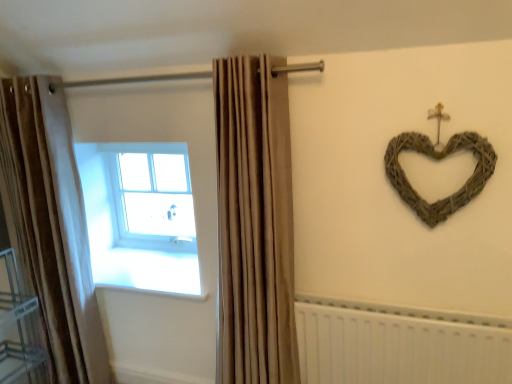
Describe the element at coordinates (398, 344) in the screenshot. Image resolution: width=512 pixels, height=384 pixels. I see `white plastic radiator at lower right` at that location.

What is the approximate height of beige fabric curtain at center, which appears as the 2th curtain when viewed from the left?

beige fabric curtain at center, which appears as the 2th curtain when viewed from the left, is 4.85 feet tall.

Image resolution: width=512 pixels, height=384 pixels. What do you see at coordinates (150, 195) in the screenshot?
I see `white glass window at upper left` at bounding box center [150, 195].

Find the location of a particular element. This screenshot has height=384, width=512. white plastic radiator at lower right is located at coordinates (398, 344).

In the image, is white glass window at upper left on the left side or the right side of metallic silver shelf at lower left?

In the image, white glass window at upper left appears on the right side of metallic silver shelf at lower left.

Is white glass window at upper left looking in the opposite direction of metallic silver shelf at lower left?

No, metallic silver shelf at lower left is not at the back of white glass window at upper left.

Does point (178, 175) appear closer or farther from the camera than point (27, 378)?

Point (178, 175) appears to be farther away from the viewer than point (27, 378).

Consider the image. Is woven natural heart at upper right facing away from white plastic radiator at lower right?

No.

Which point is more forward, (406, 144) or (332, 319)?

Positioned in front is point (406, 144).

From a real-world perspective, is woven natural heart at upper right over white plastic radiator at lower right?

Yes, from a real-world perspective, woven natural heart at upper right is above white plastic radiator at lower right.

Is the surface of beige fabric curtain at center, which appears as the 2th curtain when viewed from the left, in direct contact with beige velvet curtain at left, which is counted as the 1th curtain, starting from the left?

They are not placed beside each other.

From a real-world perspective, is beige fabric curtain at center, which ranks as the first curtain in right-to-left order, positioned above or below beige velvet curtain at left, which is counted as the 1th curtain, starting from the left?

Clearly, from a real-world perspective, beige fabric curtain at center, which ranks as the first curtain in right-to-left order, is above beige velvet curtain at left, which is counted as the 1th curtain, starting from the left.

Is beige velvet curtain at left, which is counted as the 1th curtain, starting from the left, completely or partially inside beige fabric curtain at center, which ranks as the first curtain in right-to-left order?

Definitely not — beige velvet curtain at left, which is counted as the 1th curtain, starting from the left, is not inside beige fabric curtain at center, which ranks as the first curtain in right-to-left order.

Would you say beige fabric curtain at center, which ranks as the first curtain in right-to-left order, is to the left or to the right of beige velvet curtain at left, which is counted as the 1th curtain, starting from the left, in the picture?

beige fabric curtain at center, which ranks as the first curtain in right-to-left order, is to the right of beige velvet curtain at left, which is counted as the 1th curtain, starting from the left.

Which point is more forward, (38, 146) or (321, 326)?

The point (321, 326) is closer.

How different are the orientations of beige velvet curtain at left, which is counted as the 1th curtain, starting from the left, and white plastic radiator at lower right in degrees?

The angle between the facing direction of beige velvet curtain at left, which is counted as the 1th curtain, starting from the left, and the facing direction of white plastic radiator at lower right is 3.16 degrees.

From a real-world perspective, relative to white plastic radiator at lower right, is beige velvet curtain at left, which is counted as the 1th curtain, starting from the left, vertically above or below?

From a real-world perspective, beige velvet curtain at left, which is counted as the 1th curtain, starting from the left, is physically above white plastic radiator at lower right.

Is beige velvet curtain at left, which is counted as the 1th curtain, starting from the left, positioned behind white plastic radiator at lower right?

Yes, beige velvet curtain at left, which is counted as the 1th curtain, starting from the left, is behind white plastic radiator at lower right.

Could you measure the distance between beige fabric curtain at center, which ranks as the first curtain in right-to-left order, and white plastic radiator at lower right?

beige fabric curtain at center, which ranks as the first curtain in right-to-left order, is 15.07 inches away from white plastic radiator at lower right.

Is beige fabric curtain at center, which ranks as the first curtain in right-to-left order, situated inside white plastic radiator at lower right or outside?

beige fabric curtain at center, which ranks as the first curtain in right-to-left order, is located beyond the bounds of white plastic radiator at lower right.

Who is bigger, beige fabric curtain at center, which appears as the 2th curtain when viewed from the left, or white plastic radiator at lower right?

Bigger between the two is beige fabric curtain at center, which appears as the 2th curtain when viewed from the left.

Is beige fabric curtain at center, which appears as the 2th curtain when viewed from the left, taller than white plastic radiator at lower right?

Yes.

How many degrees apart are the facing directions of white plastic radiator at lower right and white glass window at upper left?

1.9 degrees separate the facing orientations of white plastic radiator at lower right and white glass window at upper left.

Does point (367, 350) lie behind point (136, 233)?

No, (367, 350) is in front of (136, 233).

From a real-world perspective, is white plastic radiator at lower right under white glass window at upper left?

Correct, in the physical world, white plastic radiator at lower right is lower than white glass window at upper left.

Locate an element on the screen. The width and height of the screenshot is (512, 384). radiator in front of the white glass window at upper left is located at coordinates (398, 344).

Measure the distance from beige velvet curtain at left, the 2th curtain in the right-to-left sequence, to metallic silver shelf at lower left.

beige velvet curtain at left, the 2th curtain in the right-to-left sequence, and metallic silver shelf at lower left are 24.75 centimeters apart from each other.

Can metallic silver shelf at lower left be found inside beige velvet curtain at left, the 2th curtain in the right-to-left sequence?

Actually, metallic silver shelf at lower left is outside beige velvet curtain at left, the 2th curtain in the right-to-left sequence.

Considering the points (47, 291) and (12, 278), which point is behind, point (47, 291) or point (12, 278)?

The point (12, 278) is farther from the camera.

Is beige velvet curtain at left, the 2th curtain in the right-to-left sequence, touching metallic silver shelf at lower left?

They are not placed beside each other.

At what (x,y) coordinates should I click in order to perform the action: click on window on the right of metallic silver shelf at lower left. Please return your answer as a coordinate pair (x, y). The width and height of the screenshot is (512, 384). Looking at the image, I should click on (150, 195).

The image size is (512, 384). What are the coordinates of `rope in front of the white plastic radiator at lower right` in the screenshot? It's located at (439, 159).

From the image, which object appears to be farther from white glass window at upper left, white plastic radiator at lower right or woven natural heart at upper right?

Based on the image, woven natural heart at upper right appears to be further to white glass window at upper left.

From the picture: When comparing their distances from metallic silver shelf at lower left, does white glass window at upper left or white plastic radiator at lower right seem closer?

Among the two, white glass window at upper left is located nearer to metallic silver shelf at lower left.

Based on their spatial positions, is woven natural heart at upper right or white glass window at upper left further from metallic silver shelf at lower left?

Based on the image, woven natural heart at upper right appears to be further to metallic silver shelf at lower left.

Based on their spatial positions, is white plastic radiator at lower right or beige velvet curtain at left, which is counted as the 1th curtain, starting from the left, closer to woven natural heart at upper right?

Based on the image, white plastic radiator at lower right appears to be nearer to woven natural heart at upper right.

From the image, which object appears to be nearer to white plastic radiator at lower right, beige fabric curtain at center, which ranks as the first curtain in right-to-left order, or metallic silver shelf at lower left?

Among the two, beige fabric curtain at center, which ranks as the first curtain in right-to-left order, is located nearer to white plastic radiator at lower right.

Consider the image. Considering their positions, is metallic silver shelf at lower left positioned further to white plastic radiator at lower right than white glass window at upper left?

Based on the image, metallic silver shelf at lower left appears to be further to white plastic radiator at lower right.

When comparing their distances from beige velvet curtain at left, which is counted as the 1th curtain, starting from the left, does metallic silver shelf at lower left or beige fabric curtain at center, which ranks as the first curtain in right-to-left order, seem closer?

The object closer to beige velvet curtain at left, which is counted as the 1th curtain, starting from the left, is metallic silver shelf at lower left.

Based on their spatial positions, is beige velvet curtain at left, which is counted as the 1th curtain, starting from the left, or white glass window at upper left closer to beige fabric curtain at center, which ranks as the first curtain in right-to-left order?

beige velvet curtain at left, which is counted as the 1th curtain, starting from the left, is positioned closer to the anchor beige fabric curtain at center, which ranks as the first curtain in right-to-left order.

Locate an element on the screen. The image size is (512, 384). window between metallic silver shelf at lower left and beige fabric curtain at center, which ranks as the first curtain in right-to-left order, in the horizontal direction is located at coordinates (150, 195).

Where is `curtain between white glass window at upper left and white plastic radiator at lower right in the horizontal direction`? curtain between white glass window at upper left and white plastic radiator at lower right in the horizontal direction is located at coordinates coord(254,223).

Locate an element on the screen. This screenshot has height=384, width=512. window located between beige velvet curtain at left, which is counted as the 1th curtain, starting from the left, and white plastic radiator at lower right in the left-right direction is located at coordinates (150, 195).

You are a GUI agent. You are given a task and a screenshot of the screen. Output one action in this format:
    pyautogui.click(x=<x>, y=<y>)
    Task: Click on the curtain between beige velvet curtain at left, which is counted as the 1th curtain, starting from the left, and white plastic radiator at lower right from left to right
    
    Given the screenshot: What is the action you would take?
    pyautogui.click(x=254, y=223)